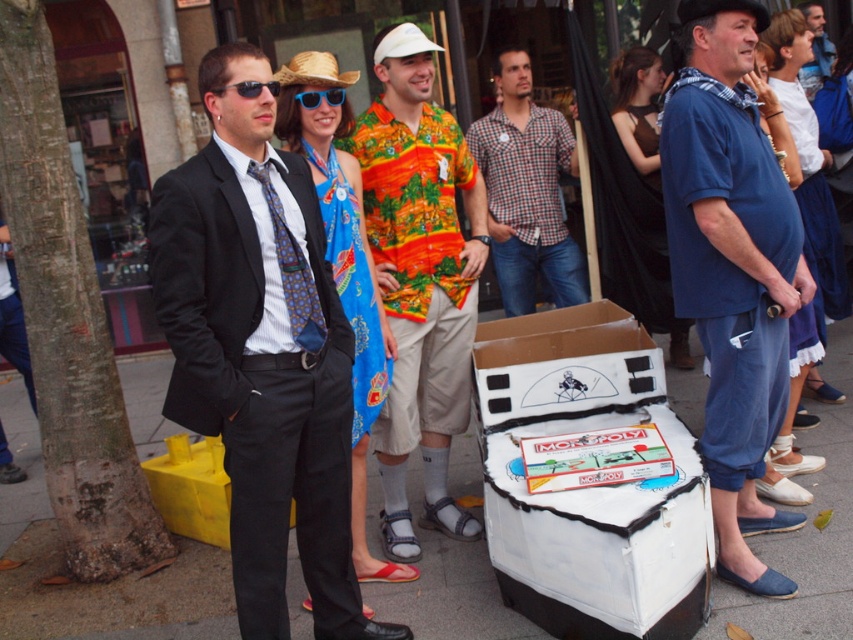
Question: Is white cardboard monopoly box at lower center bigger than printed cotton shirt at center?

Choices:
 (A) yes
 (B) no

Answer: (A)

Question: Which of these objects is positioned farthest from the white cardboard box at center?

Choices:
 (A) blue patterned tie at center
 (B) white cardboard monopoly box at lower center

Answer: (B)

Question: Does printed cotton shirt at center appear on the left side of blue patterned tie at center?

Choices:
 (A) no
 (B) yes

Answer: (A)

Question: Which object appears farthest from the camera in this image?

Choices:
 (A) white cardboard monopoly box at lower center
 (B) black plastic sunglasses at upper center

Answer: (A)

Question: Which object appears farthest from the camera in this image?

Choices:
 (A) blue cotton shirt at right
 (B) checkered fabric shirt at center
 (C) matte black suit at left
 (D) printed cotton shirt at center

Answer: (B)

Question: Is printed cotton shirt at center further to camera compared to black plastic sunglasses at upper center?

Choices:
 (A) no
 (B) yes

Answer: (B)